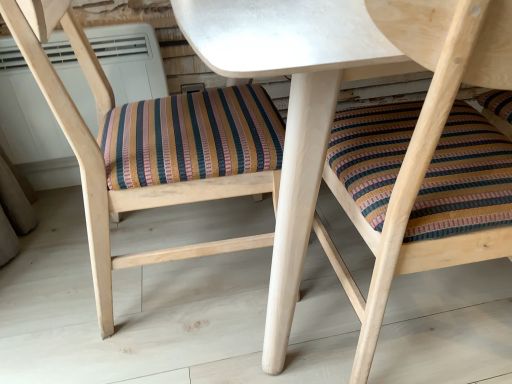
Question: Does wooden chair with striped cushion at center, marked as the first chair in a right-to-left arrangement, have a larger size compared to white plastic air conditioner at upper center?

Choices:
 (A) no
 (B) yes

Answer: (B)

Question: Is wooden chair with striped cushion at center, the second chair when ordered from left to right, touching white plastic air conditioner at upper center?

Choices:
 (A) yes
 (B) no

Answer: (B)

Question: Can you confirm if wooden chair with striped cushion at center, the second chair when ordered from left to right, is shorter than white plastic air conditioner at upper center?

Choices:
 (A) no
 (B) yes

Answer: (A)

Question: Is wooden chair with striped cushion at center, marked as the first chair in a right-to-left arrangement, far from white plastic air conditioner at upper center?

Choices:
 (A) no
 (B) yes

Answer: (A)

Question: From a real-world perspective, is wooden chair with striped cushion at center, marked as the first chair in a right-to-left arrangement, located higher than white plastic air conditioner at upper center?

Choices:
 (A) yes
 (B) no

Answer: (A)

Question: From the image's perspective, is wooden chair with striped cushion at center, the second chair when ordered from left to right, located beneath white plastic air conditioner at upper center?

Choices:
 (A) no
 (B) yes

Answer: (B)

Question: From a real-world perspective, is white plastic air conditioner at upper center positioned under wooden chair with striped cushion at center, marked as the first chair in a right-to-left arrangement, based on gravity?

Choices:
 (A) yes
 (B) no

Answer: (A)

Question: Considering the relative sizes of white plastic air conditioner at upper center and wooden chair with striped cushion at center, the second chair when ordered from left to right, in the image provided, is white plastic air conditioner at upper center shorter than wooden chair with striped cushion at center, the second chair when ordered from left to right,?

Choices:
 (A) no
 (B) yes

Answer: (B)

Question: Considering the relative positions of white plastic air conditioner at upper center and wooden chair with striped cushion at center, the second chair when ordered from left to right, in the image provided, is white plastic air conditioner at upper center to the left of wooden chair with striped cushion at center, the second chair when ordered from left to right, from the viewer's perspective?

Choices:
 (A) no
 (B) yes

Answer: (B)

Question: Considering the relative sizes of white plastic air conditioner at upper center and wooden chair with striped cushion at center, the second chair when ordered from left to right, in the image provided, is white plastic air conditioner at upper center smaller than wooden chair with striped cushion at center, the second chair when ordered from left to right,?

Choices:
 (A) yes
 (B) no

Answer: (A)

Question: Is white plastic air conditioner at upper center wider than wooden chair with striped cushion at center, marked as the first chair in a right-to-left arrangement?

Choices:
 (A) no
 (B) yes

Answer: (A)

Question: From a real-world perspective, does white plastic air conditioner at upper center stand above wooden chair with striped cushion at center, the second chair when ordered from left to right?

Choices:
 (A) no
 (B) yes

Answer: (A)

Question: From a real-world perspective, is white matte table at center physically above multicolored woven cushion at center, the 2th chair from the right?

Choices:
 (A) yes
 (B) no

Answer: (B)